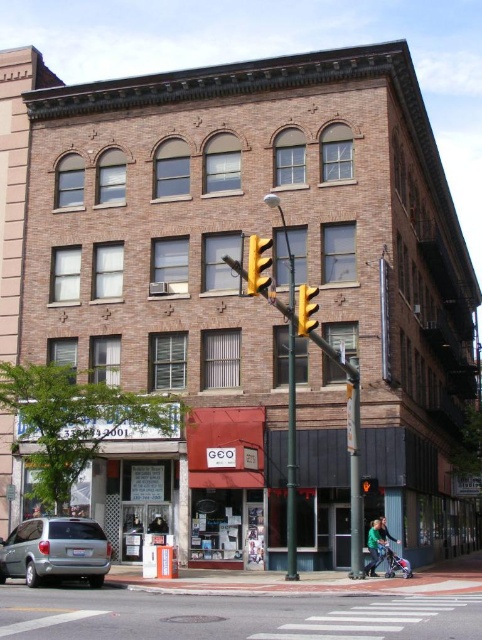
Is point (263, 260) more distant than point (307, 292)?

That is False.

Between point (259, 243) and point (313, 291), which one is positioned behind?

Point (313, 291)

Find the location of a particular element. The height and width of the screenshot is (640, 482). yellow metallic traffic light at center is located at coordinates (257, 264).

Is point (39, 584) less distant than point (305, 336)?

Yes.

Does silver metallic minivan at lower left appear over yellow matte traffic light at center?

No, silver metallic minivan at lower left is not above yellow matte traffic light at center.

Does point (8, 576) come behind point (313, 310)?

Yes, point (8, 576) is farther from viewer.

You are a GUI agent. You are given a task and a screenshot of the screen. Output one action in this format:
    pyautogui.click(x=<x>, y=<y>)
    Task: Click on the silver metallic minivan at lower left
    
    Given the screenshot: What is the action you would take?
    pyautogui.click(x=55, y=550)

Between silver metallic minivan at lower left and yellow metallic traffic light at center, which one has less height?

silver metallic minivan at lower left

Can you confirm if silver metallic minivan at lower left is positioned to the left of yellow metallic traffic light at center?

Indeed, silver metallic minivan at lower left is positioned on the left side of yellow metallic traffic light at center.

Which is behind, point (13, 545) or point (270, 237)?

The point (270, 237) is behind.

Where is `silver metallic minivan at lower left`? This screenshot has height=640, width=482. silver metallic minivan at lower left is located at coordinates pyautogui.click(x=55, y=550).